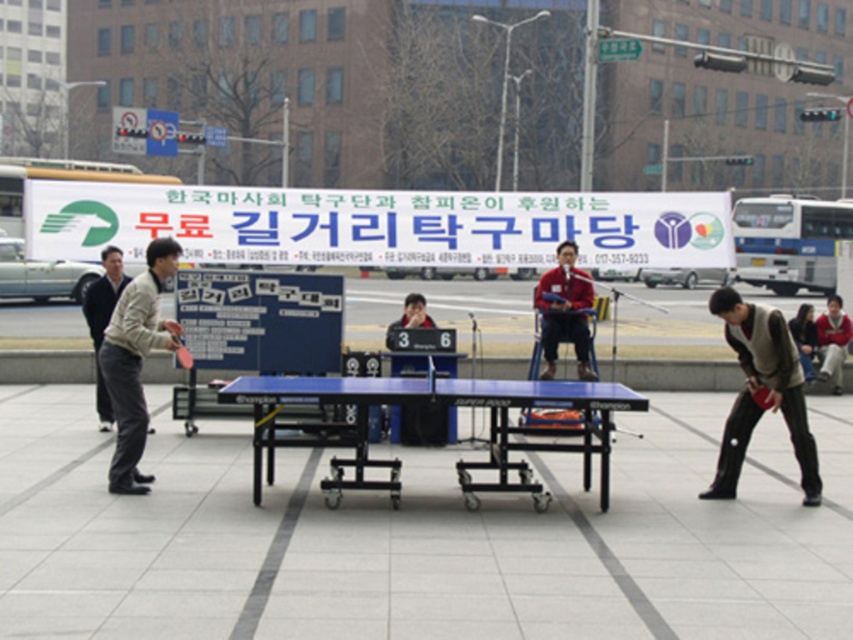
Who is shorter, light beige fabric jacket at left or light beige jacket at left?

light beige jacket at left

Does light beige fabric jacket at left appear on the left side of light beige jacket at left?

Incorrect, light beige fabric jacket at left is not on the left side of light beige jacket at left.

Between point (125, 378) and point (102, 428), which one is positioned behind?

The point (102, 428) is behind.

This screenshot has width=853, height=640. Identify the location of light beige fabric jacket at left. (135, 362).

Is red sweater at center below blue plastic table tennis table at center?

No, red sweater at center is not below blue plastic table tennis table at center.

Is red sweater at center bigger than blue plastic table tennis table at center?

Indeed, red sweater at center has a larger size compared to blue plastic table tennis table at center.

The image size is (853, 640). What do you see at coordinates (833, 340) in the screenshot?
I see `red sweater at center` at bounding box center [833, 340].

You are a GUI agent. You are given a task and a screenshot of the screen. Output one action in this format:
    pyautogui.click(x=<x>, y=<y>)
    Task: Click on the red sweater at center
    The height and width of the screenshot is (640, 853).
    Given the screenshot: What is the action you would take?
    pyautogui.click(x=833, y=340)

Measure the distance between point (795, 388) and camera.

Point (795, 388) is 25.85 feet away from camera.

From the picture: Is dark brown leather vest at lower right above dark brown leather jacket at lower right?

Incorrect, dark brown leather vest at lower right is not positioned above dark brown leather jacket at lower right.

Image resolution: width=853 pixels, height=640 pixels. In order to click on dark brown leather vest at lower right in this screenshot , I will do `click(762, 385)`.

The height and width of the screenshot is (640, 853). In order to click on dark brown leather vest at lower right in this screenshot , I will do `click(762, 385)`.